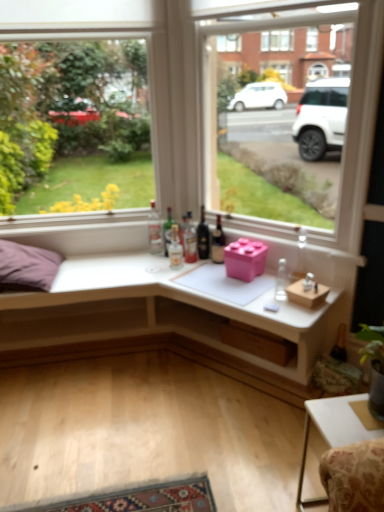
Locate an element on the screen. The height and width of the screenshot is (512, 384). free area in between wooden box at right, which appears as the 2th window box when viewed from the top, and pink matte plastic cube at center, positioned as the third window box in bottom-to-top order is located at coordinates point(264,285).